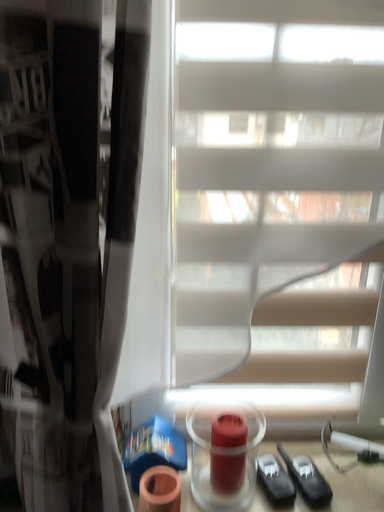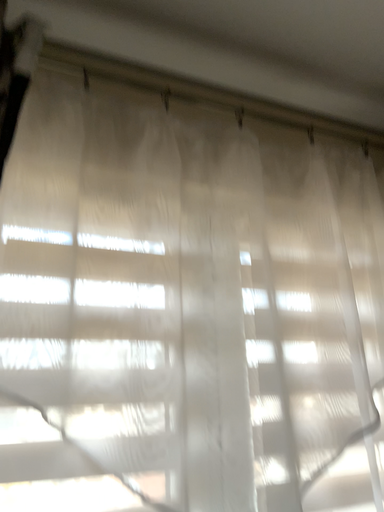
Question: Which way did the camera rotate in the video?

Choices:
 (A) rotated right
 (B) rotated left

Answer: (A)